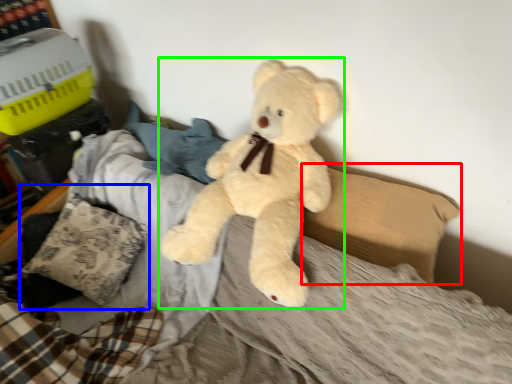
Question: Considering the real-world distances, which object is farthest from pillow (highlighted by a red box)? pillow (highlighted by a blue box) or teddy bear (highlighted by a green box)?

Choices:
 (A) pillow
 (B) teddy bear

Answer: (A)